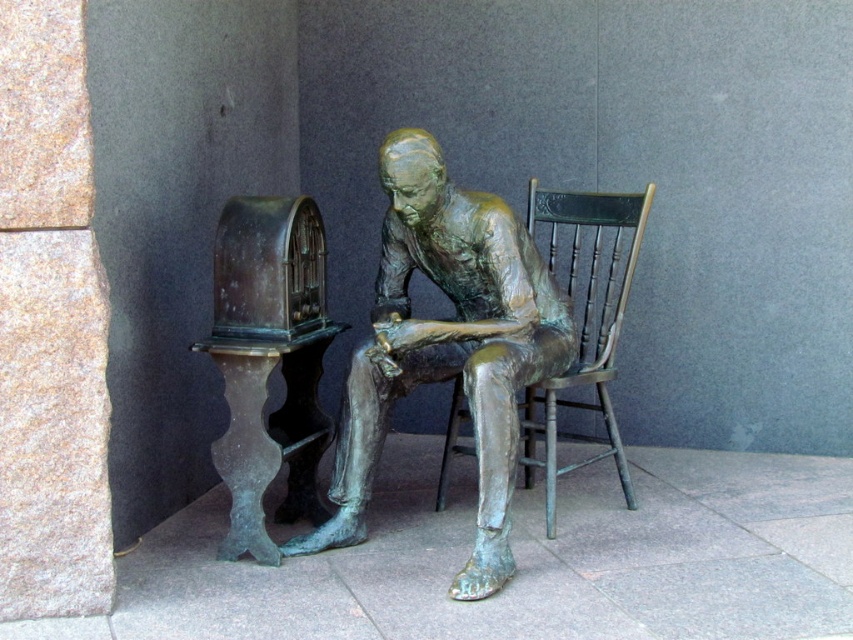
You are a museum curator who needs to move a 16 inch wide sculpture from its current location to a new spot in the gallery. You see the green patina statue at center and the bronze wooden chair at center. Can you fit the sculpture between them without moving either object?

The green patina statue at center and bronze wooden chair at center are 17.50 inches apart, so a 16 inch wide sculpture can fit between them since the space is larger than the sculpture.

You are standing in front of the bronze sculpture and want to sit down on the bronze wooden chair at center. Is the green patina statue at center blocking your path to the chair?

The green patina statue at center is in front of the bronze wooden chair at center, so it is blocking the path to the chair. You would need to move around it or go around the statue to reach the chair.